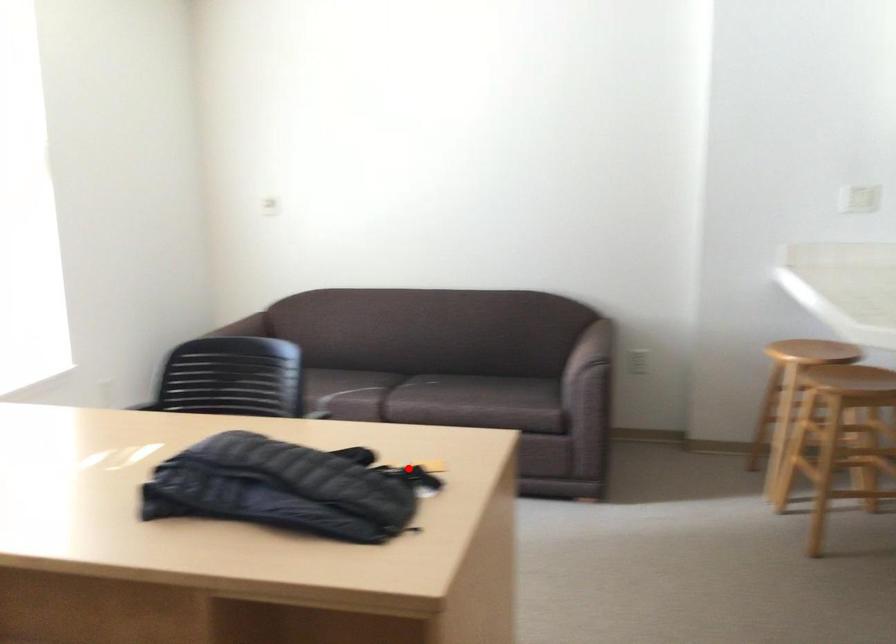
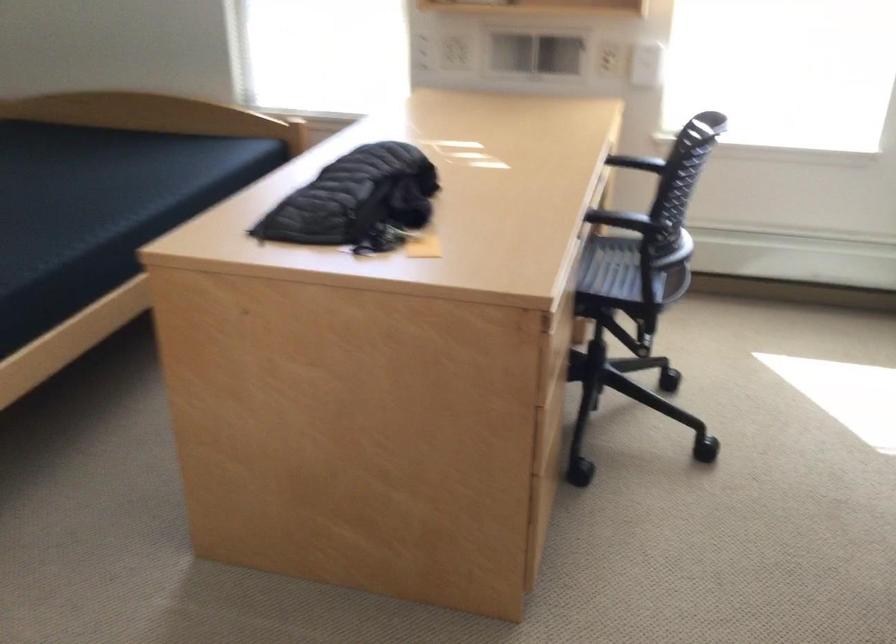
Find the pixel in the second image that matches the highlighted location in the first image.

(421, 245)